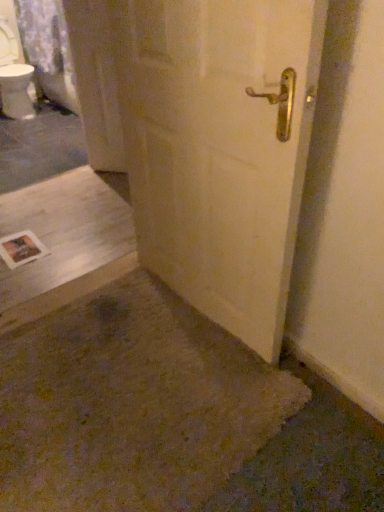
Describe the element at coordinates (220, 148) in the screenshot. The height and width of the screenshot is (512, 384). I see `white matte door at center` at that location.

Find the location of a particular element. white matte door at center is located at coordinates (220, 148).

In order to face white matte door at center, should I rotate leftwards or rightwards?

To align with it, rotate right about 0.301°.

Find the location of a particular element. This screenshot has width=384, height=512. white concrete at lower left is located at coordinates (64, 243).

The height and width of the screenshot is (512, 384). What do you see at coordinates (64, 243) in the screenshot? I see `white concrete at lower left` at bounding box center [64, 243].

In order to click on white matte door at center in this screenshot , I will do `click(220, 148)`.

In the image, is white matte door at center on the left side or the right side of white concrete at lower left?

white matte door at center is to the right of white concrete at lower left.

From the picture: In the image, is white matte door at center positioned in front of or behind white concrete at lower left?

In the image, white matte door at center appears in front of white concrete at lower left.

Is point (183, 219) farther from camera compared to point (58, 198)?

That is False.

From the image's perspective, which is below, white matte door at center or white concrete at lower left?

white concrete at lower left is shown below in the image.

From a real-world perspective, is white matte door at center located higher than white concrete at lower left?

Yes, from a real-world perspective, white matte door at center is above white concrete at lower left.

Does white matte door at center have a greater width compared to white concrete at lower left?

In fact, white matte door at center might be narrower than white concrete at lower left.

Can you confirm if white matte door at center is shorter than white concrete at lower left?

Incorrect, the height of white matte door at center does not fall short of that of white concrete at lower left.

Looking at this image, in terms of size, does white matte door at center appear bigger or smaller than white concrete at lower left?

white matte door at center is bigger than white concrete at lower left.

Would you say white matte door at center is inside or outside white concrete at lower left?

white matte door at center is not enclosed by white concrete at lower left.

Is white matte door at center not near white concrete at lower left?

Actually, white matte door at center and white concrete at lower left are a little close together.

Is white matte door at center facing towards white concrete at lower left?

No, white matte door at center is not turned towards white concrete at lower left.

The height and width of the screenshot is (512, 384). I want to click on door above the white concrete at lower left (from a real-world perspective), so click(x=220, y=148).

Considering the relative positions of white concrete at lower left and white matte door at center in the image provided, is white concrete at lower left to the left or to the right of white matte door at center?

white concrete at lower left is to the left of white matte door at center.

Is the position of white concrete at lower left more distant than that of white matte door at center?

Yes, it is.

Does point (70, 245) lie behind point (237, 84)?

Yes, it is behind point (237, 84).

Looking at this image, from the image's perspective, between white concrete at lower left and white matte door at center, which one is located above?

white matte door at center.

From a real-world perspective, between white concrete at lower left and white matte door at center, who is vertically lower?

white concrete at lower left, from a real-world perspective.

Looking at their sizes, would you say white concrete at lower left is wider or thinner than white matte door at center?

Considering their sizes, white concrete at lower left looks broader than white matte door at center.

Between white concrete at lower left and white matte door at center, which one has less height?

With less height is white concrete at lower left.

Considering the sizes of white concrete at lower left and white matte door at center in the image, is white concrete at lower left bigger or smaller than white matte door at center?

Considering their sizes, white concrete at lower left takes up less space than white matte door at center.

Is white concrete at lower left not within white matte door at center?

Absolutely, white concrete at lower left is external to white matte door at center.

Is white concrete at lower left next to white matte door at center and touching it?

No, white concrete at lower left is not beside white matte door at center.

Is white concrete at lower left oriented away from white matte door at center?

No, white concrete at lower left's orientation is not away from white matte door at center.

How many degrees apart are the facing directions of white concrete at lower left and white matte door at center?

They differ by 90.6 degrees in their facing directions.

There is a white concrete at lower left. In order to click on door above it (from a real-world perspective) in this screenshot , I will do `click(220, 148)`.

Where is `concrete beneath the white matte door at center (from a real-world perspective)`? This screenshot has height=512, width=384. concrete beneath the white matte door at center (from a real-world perspective) is located at coordinates (64, 243).

I want to click on concrete located on the left of white matte door at center, so click(64, 243).